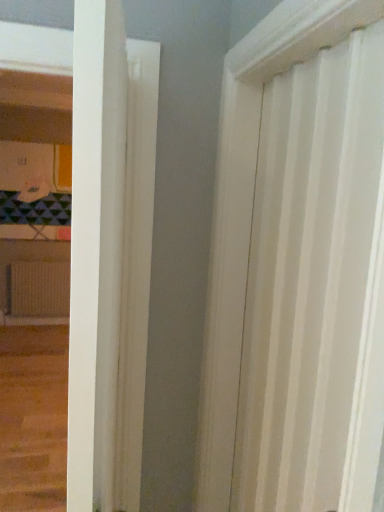
The height and width of the screenshot is (512, 384). I want to click on white wood screen door at right, so click(297, 267).

The image size is (384, 512). What do you see at coordinates (297, 267) in the screenshot?
I see `white wood screen door at right` at bounding box center [297, 267].

The height and width of the screenshot is (512, 384). In order to click on white wood screen door at right in this screenshot , I will do `click(297, 267)`.